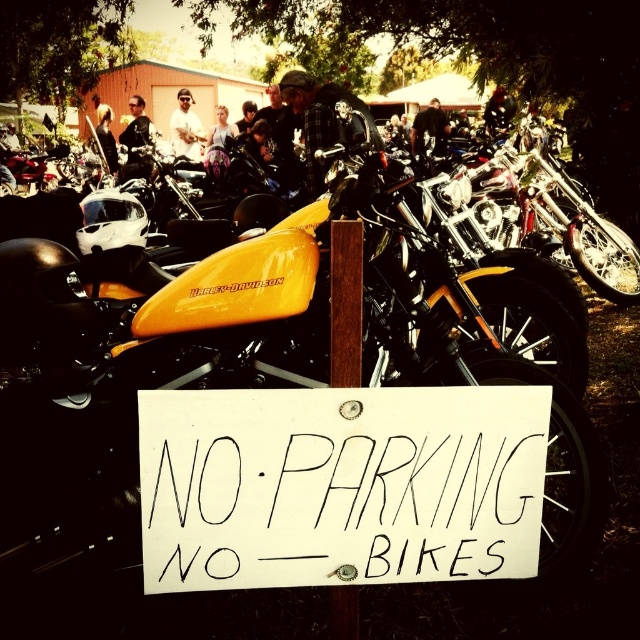
Question: Where is white paper sign at center located in relation to wooden post at center in the image?

Choices:
 (A) above
 (B) below

Answer: (B)

Question: Is wooden post at center further to camera compared to yellowharley-davidson logo at center?

Choices:
 (A) no
 (B) yes

Answer: (A)

Question: Estimate the real-world distances between objects in this image. Which object is farther from the white paper sign at center?

Choices:
 (A) yellowharley-davidson logo at center
 (B) wooden post at center

Answer: (A)

Question: Which of the following is the farthest from the observer?

Choices:
 (A) (314, 552)
 (B) (204, 288)
 (C) (349, 246)

Answer: (B)

Question: Which point is closer to the camera taking this photo?

Choices:
 (A) (264, 388)
 (B) (214, 285)
 (C) (362, 232)

Answer: (C)

Question: Does white paper sign at center appear on the right side of yellowharley-davidson logo at center?

Choices:
 (A) no
 (B) yes

Answer: (B)